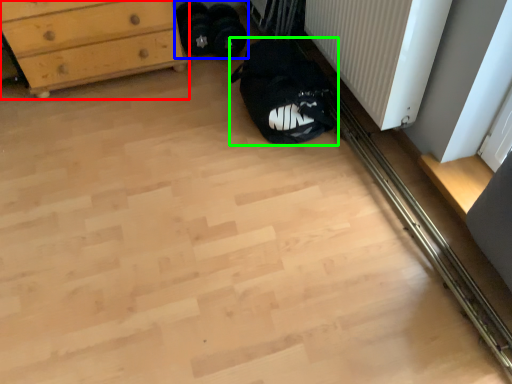
Question: Which object is the farthest from chest of drawers (highlighted by a red box)? Choose among these: footwear (highlighted by a blue box) or sleeping bag (highlighted by a green box).

Choices:
 (A) footwear
 (B) sleeping bag

Answer: (B)